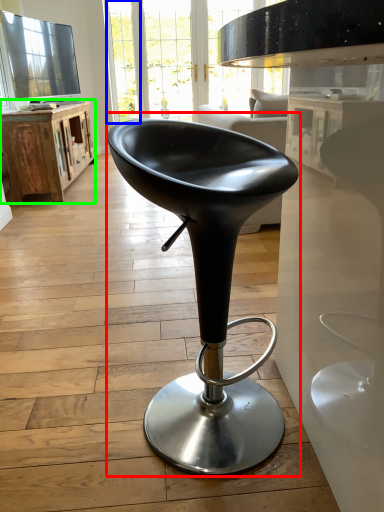
Question: Which object is positioned farthest from chair (highlighted by a red box)? Select from glass door (highlighted by a blue box) and table (highlighted by a green box).

Choices:
 (A) glass door
 (B) table

Answer: (A)